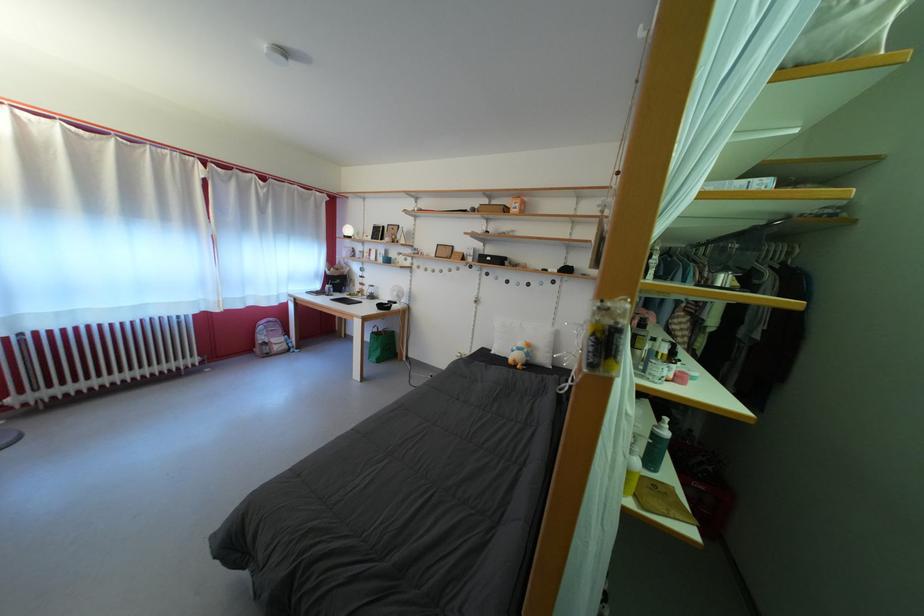
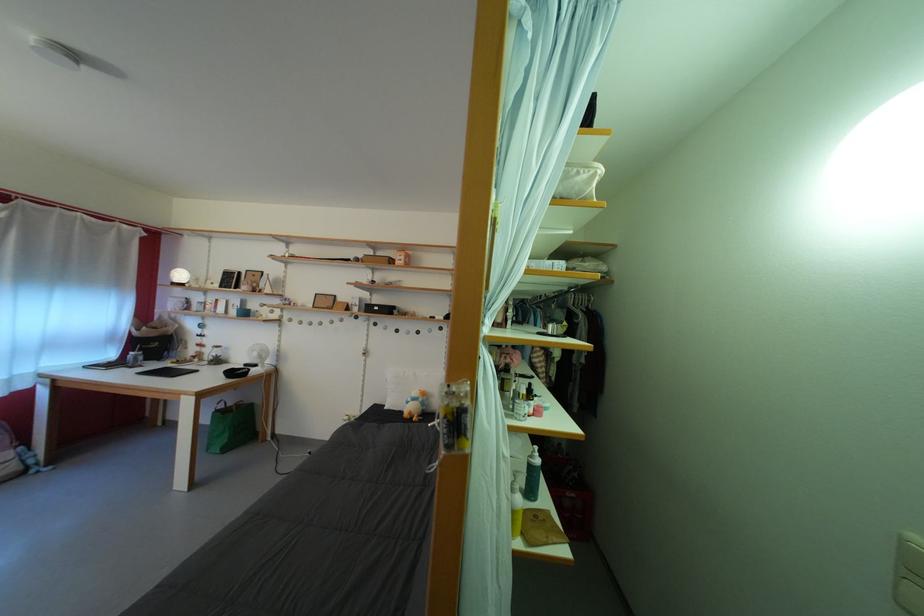
Where in the second image is the point corresponding to (382,339) from the first image?

(225, 416)